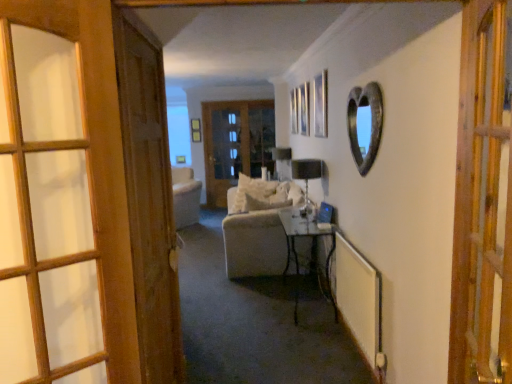
Question: From their relative heights in the image, would you say rustic metal heart-shaped mirror at upper right is taller or shorter than wooden door at left, placed as the third door when sorted from back to front?

Choices:
 (A) tall
 (B) short

Answer: (B)

Question: Considering their positions, is rustic metal heart-shaped mirror at upper right located in front of or behind wooden door at left, which is counted as the 4th door, starting from the right?

Choices:
 (A) front
 (B) behind

Answer: (B)

Question: Which of these objects is positioned farthest from the metallic silver table at center?

Choices:
 (A) wooden door at left, placed as the third door when sorted from back to front
 (B) matte black lampshade at center, which ranks as the first lamp in back-to-front order
 (C) matte wooden picture frame at upper center, acting as the first picture frame starting from the top
 (D) transparent glass door at center
 (E) white soft pillow at center

Answer: (C)

Question: Considering the real-world distances, which object is closest to the white soft pillow at center?

Choices:
 (A) rustic metal heart-shaped mirror at upper right
 (B) wooden door at right, arranged as the first door when viewed from the front
 (C) matte wooden picture frame at upper center, which ranks as the 2th picture frame in front-to-back order
 (D) metallic silver picture frame at upper center, which ranks as the 1th picture frame in front-to-back order
 (E) wooden glass door at center, the 3th door when ordered from left to right

Answer: (D)